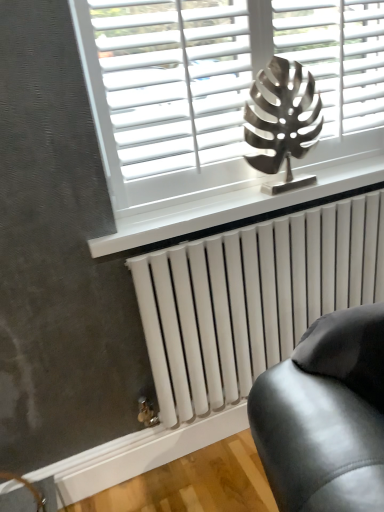
Question: From the image's perspective, is white metallic radiator at lower center above or below white matte blinds at upper center?

Choices:
 (A) above
 (B) below

Answer: (B)

Question: In terms of width, does white metallic radiator at lower center look wider or thinner when compared to white matte blinds at upper center?

Choices:
 (A) thin
 (B) wide

Answer: (B)

Question: Estimate the real-world distances between objects in this image. Which object is farther from the white metallic radiator at lower center?

Choices:
 (A) white glossy radiator at lower center
 (B) metallic leaf at center
 (C) white matte blinds at upper center

Answer: (C)

Question: Which of these objects is positioned closest to the metallic leaf at center?

Choices:
 (A) white matte blinds at upper center
 (B) white metallic radiator at lower center
 (C) white glossy radiator at lower center

Answer: (A)